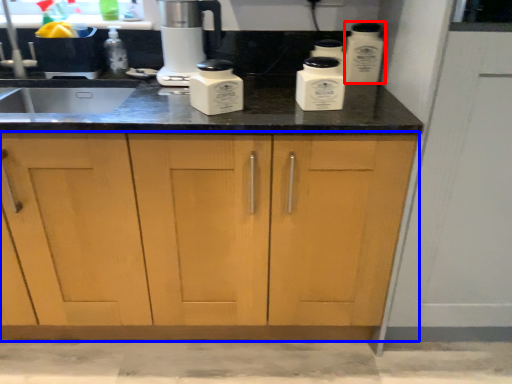
Question: Which object is further to the camera taking this photo, kitchen appliance (highlighted by a red box) or cabinetry (highlighted by a blue box)?

Choices:
 (A) kitchen appliance
 (B) cabinetry

Answer: (A)